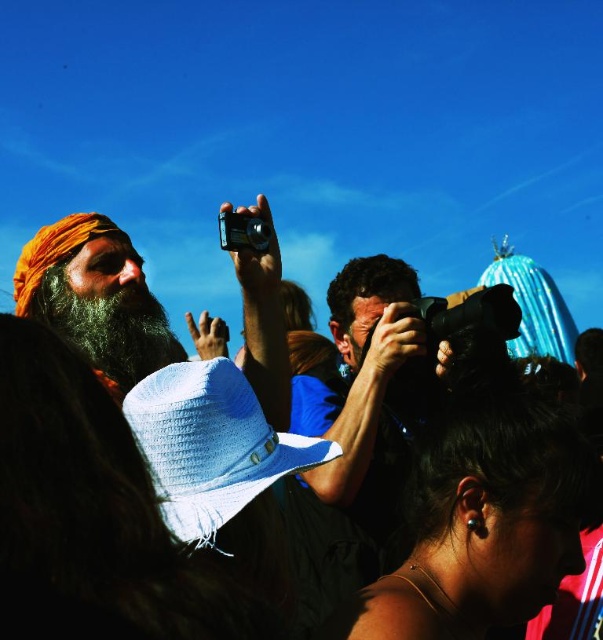
The height and width of the screenshot is (640, 603). What do you see at coordinates (93, 292) in the screenshot? I see `matte orange turban at upper left` at bounding box center [93, 292].

Is point (87, 300) more distant than point (92, 348)?

Yes, it is.

Is point (71, 234) more distant than point (77, 308)?

Yes, point (71, 234) is behind point (77, 308).

Where is `matte orange turban at upper left`? The width and height of the screenshot is (603, 640). matte orange turban at upper left is located at coordinates (93, 292).